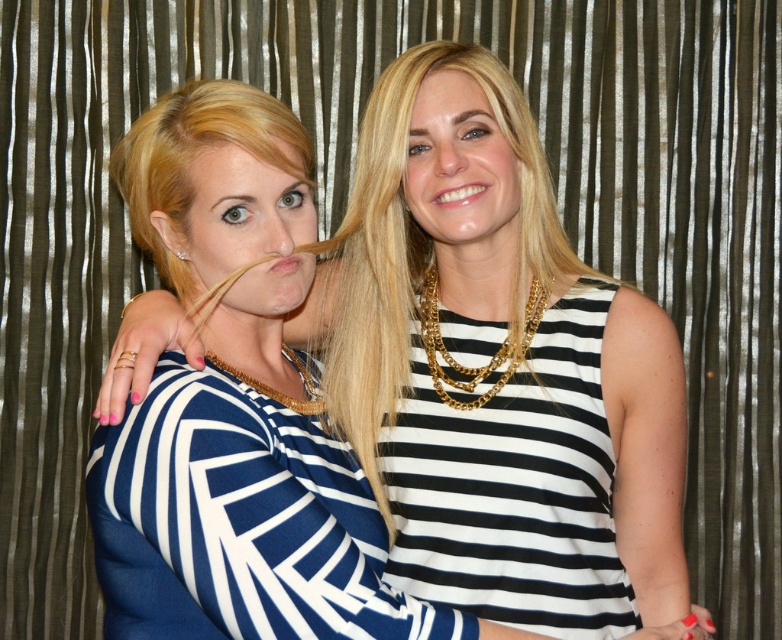
Question: Is blue striped dress at center to the left of navy blue jersey dress at center from the viewer's perspective?

Choices:
 (A) no
 (B) yes

Answer: (A)

Question: Is blue striped dress at center to the left of black and white striped dress at center from the viewer's perspective?

Choices:
 (A) no
 (B) yes

Answer: (B)

Question: Among these objects, which one is farthest from the camera?

Choices:
 (A) navy blue jersey dress at center
 (B) black and white striped dress at center

Answer: (B)

Question: Which of the following is the farthest from the observer?

Choices:
 (A) (533, 611)
 (B) (542, 237)
 (C) (256, 388)

Answer: (B)

Question: Which of the following is the closest to the observer?

Choices:
 (A) navy blue jersey dress at center
 (B) blue striped dress at center
 (C) black and white striped dress at center

Answer: (A)

Question: Can you confirm if blue striped dress at center is bigger than navy blue jersey dress at center?

Choices:
 (A) no
 (B) yes

Answer: (B)